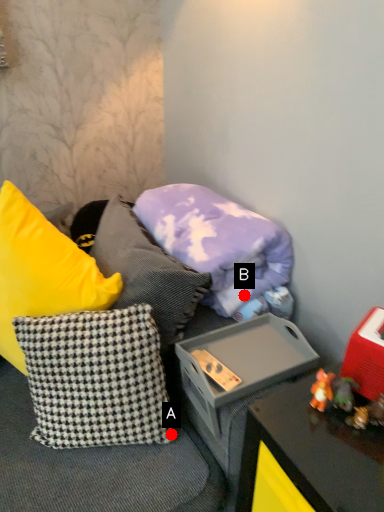
Question: Two points are circled on the image, labeled by A and B beside each circle. Among these points, which one is farthest from the camera?

Choices:
 (A) A is further
 (B) B is further

Answer: (B)